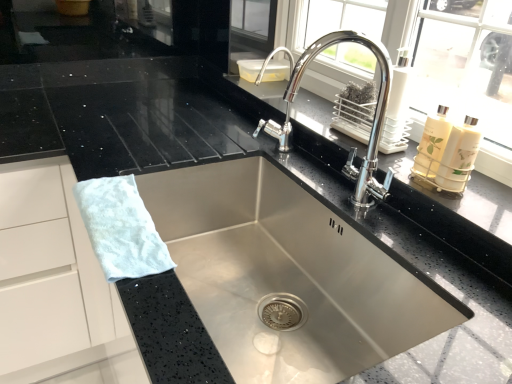
Find the location of a particular element. free spot below polished chrome faucet at upper center (from a real-world perspective) is located at coordinates (346, 202).